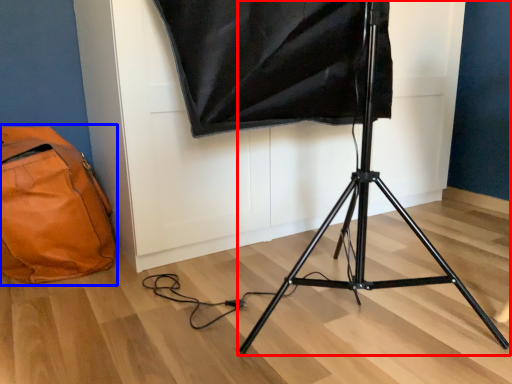
Question: Which of the following is the closest to the observer, tripod (highlighted by a red box) or bag (highlighted by a blue box)?

Choices:
 (A) tripod
 (B) bag

Answer: (A)